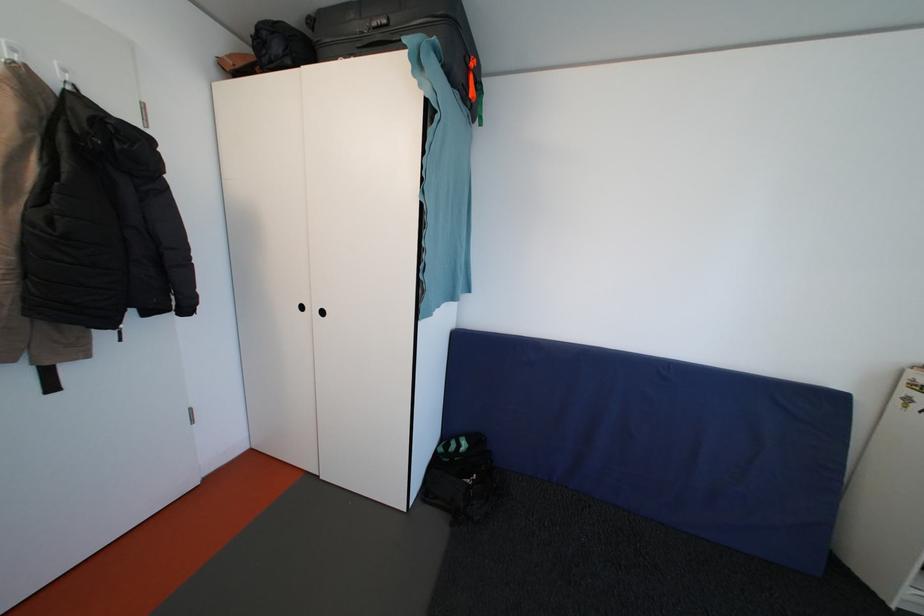
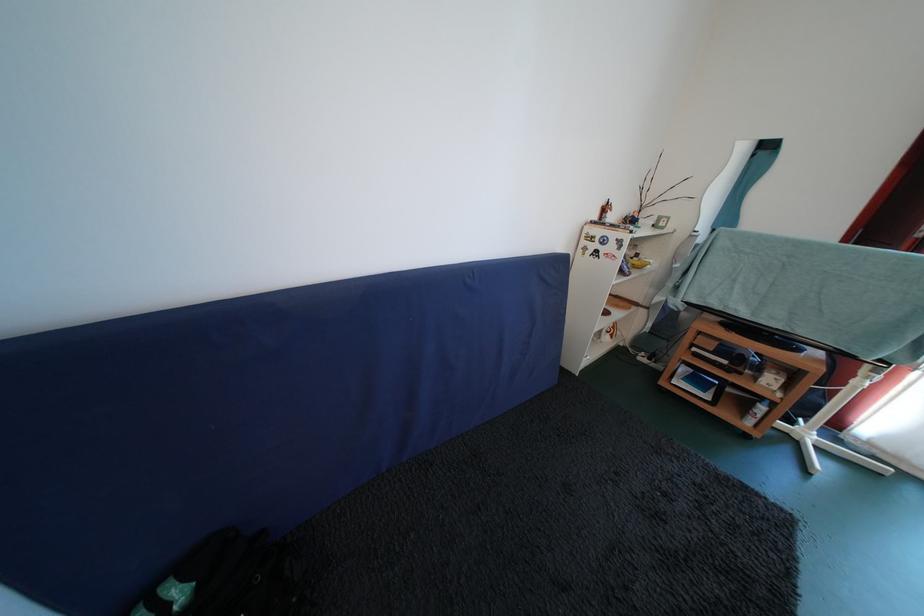
Based on the continuous images, in which direction is the camera rotating?

The camera's rotation is toward right-down.